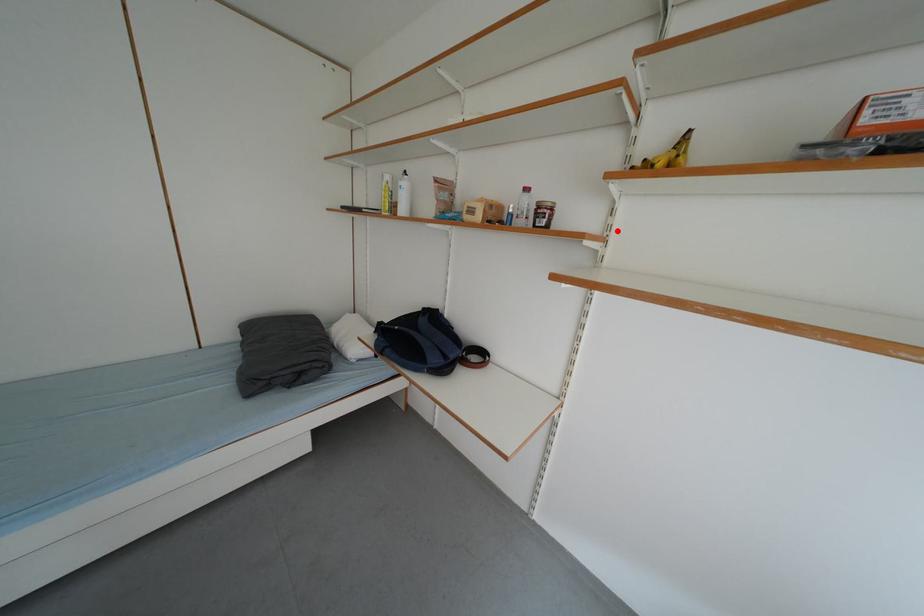
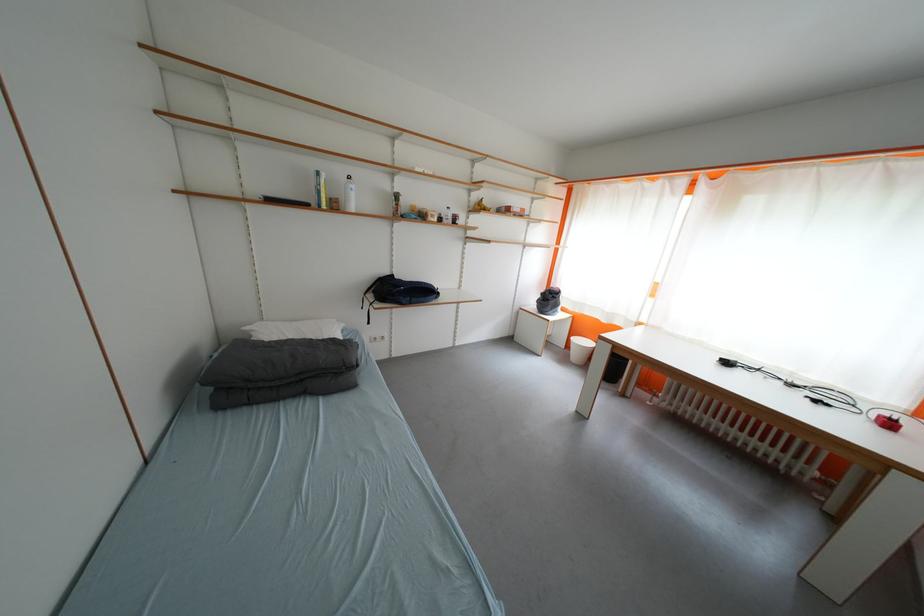
Question: I am providing you with two images of the same scene from different viewpoints. Image1 has a red point marked. In image2, the corresponding 3D location appears at what relative position? Reply with the corresponding letter.

Choices:
 (A) Closer
 (B) Farther

Answer: (A)